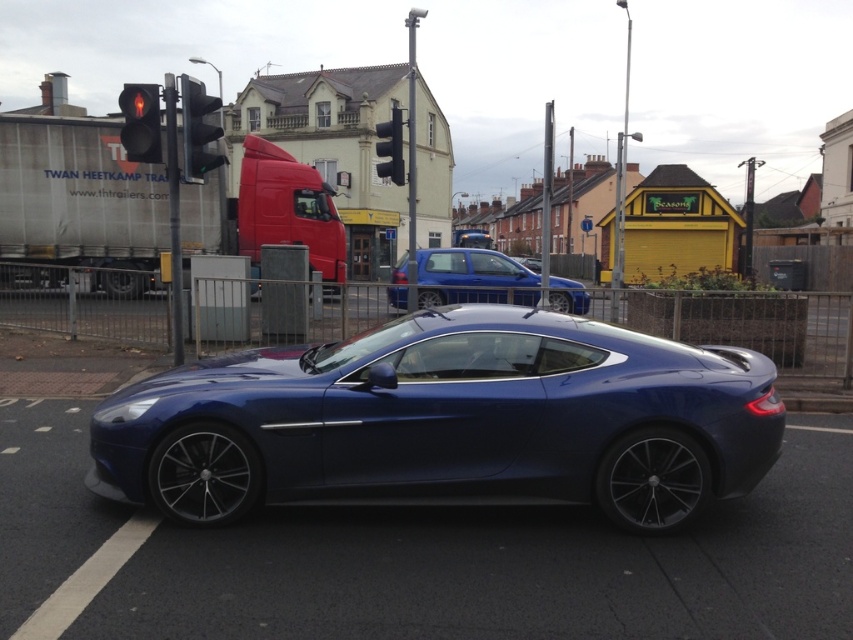
Measure the distance between point (508, 368) and camera.

Point (508, 368) and camera are 5.23 meters apart.

Does glossy blue sports car at center appear on the left side of matte blue hatchback at center?

Indeed, glossy blue sports car at center is positioned on the left side of matte blue hatchback at center.

The image size is (853, 640). What do you see at coordinates (448, 420) in the screenshot?
I see `glossy blue sports car at center` at bounding box center [448, 420].

You are a GUI agent. You are given a task and a screenshot of the screen. Output one action in this format:
    pyautogui.click(x=<x>, y=<y>)
    Task: Click on the glossy blue sports car at center
    The image size is (853, 640).
    Given the screenshot: What is the action you would take?
    pyautogui.click(x=448, y=420)

Can you confirm if matte blue hatchback at center is positioned to the right of red glass traffic light at upper left?

Indeed, matte blue hatchback at center is positioned on the right side of red glass traffic light at upper left.

The width and height of the screenshot is (853, 640). I want to click on matte blue hatchback at center, so click(x=473, y=276).

I want to click on matte blue hatchback at center, so click(473, 276).

Identify the location of matte blue hatchback at center. This screenshot has height=640, width=853. (473, 276).

Which is in front, point (138, 88) or point (387, 164)?

Positioned in front is point (138, 88).

Locate an element on the screen. The height and width of the screenshot is (640, 853). red glass traffic light at upper left is located at coordinates (140, 122).

In order to click on red glass traffic light at upper left in this screenshot , I will do `click(140, 122)`.